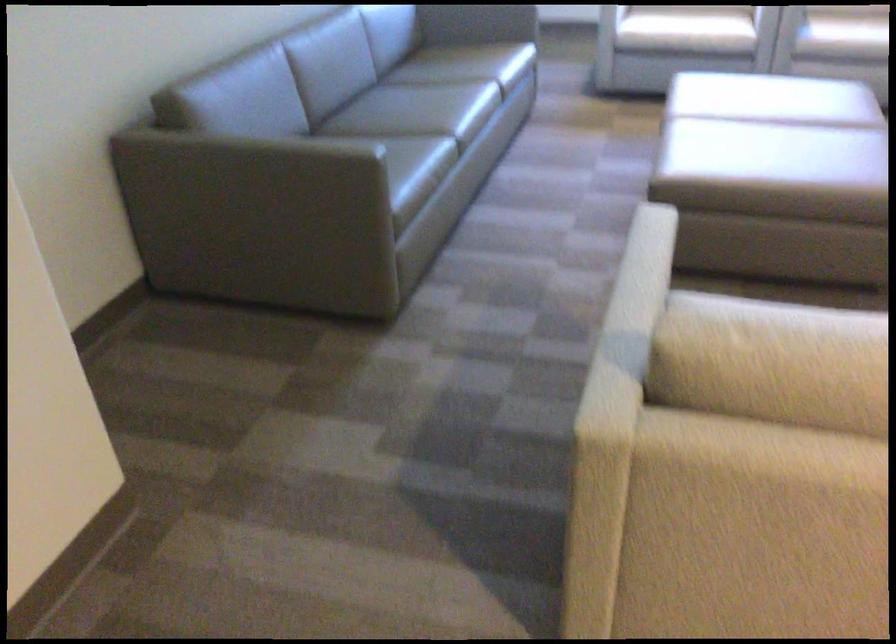
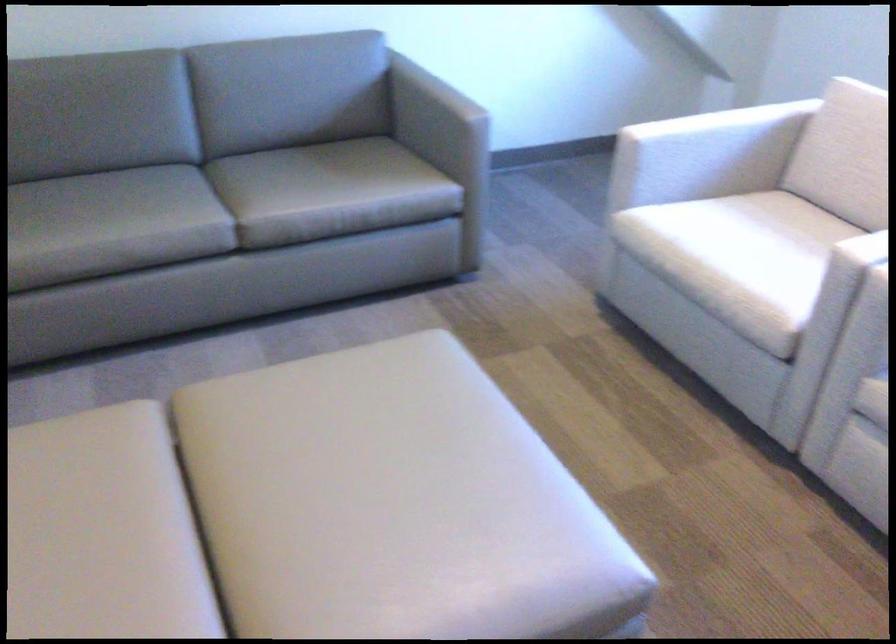
Where in the second image is the point corresponding to point (734, 91) from the first image?

(348, 446)